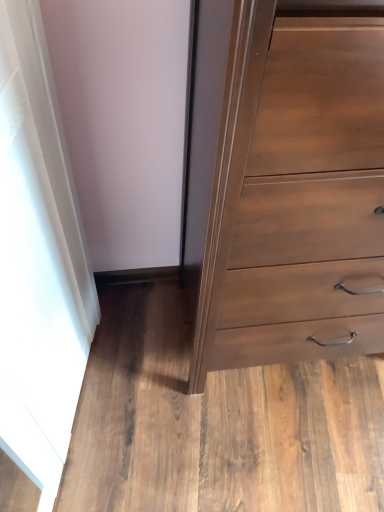
Describe the element at coordinates (295, 195) in the screenshot. The image size is (384, 512). I see `shiny brown wood chest of drawers at right` at that location.

This screenshot has height=512, width=384. I want to click on shiny brown wood chest of drawers at right, so click(x=295, y=195).

Find the location of a particular element. The height and width of the screenshot is (512, 384). shiny brown wood chest of drawers at right is located at coordinates (295, 195).